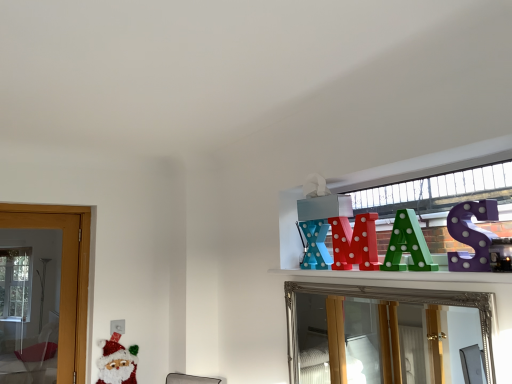
Identify the location of free space above silver/glass mirror at upper center (from a real-world perspective). The width and height of the screenshot is (512, 384). (386, 284).